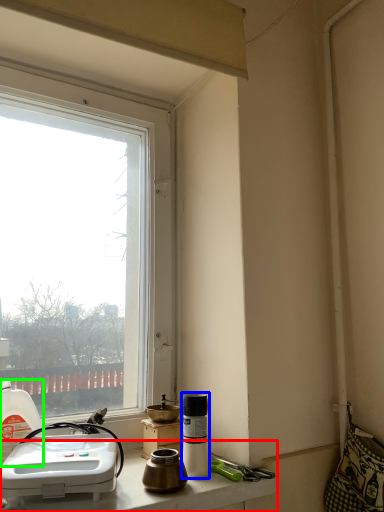
Question: Considering the real-world distances, which object is farthest from counter top (highlighted by a red box)? bottle (highlighted by a blue box) or bottle (highlighted by a green box)?

Choices:
 (A) bottle
 (B) bottle

Answer: (B)